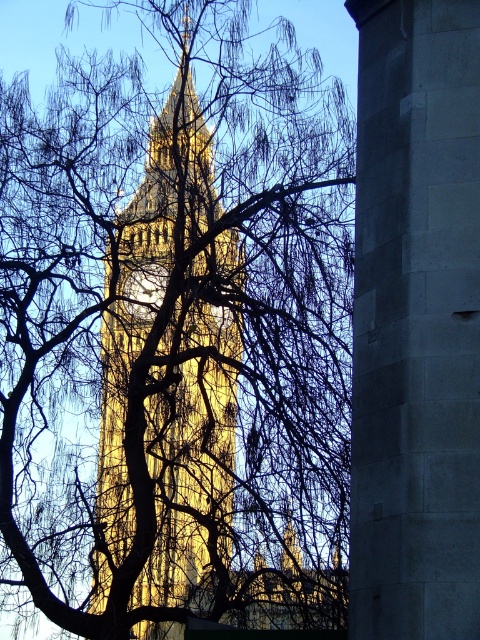
Question: In this image, where is gray stone pillar at center located relative to golden stone tower at center?

Choices:
 (A) left
 (B) right

Answer: (B)

Question: Which object is farther from the camera taking this photo?

Choices:
 (A) golden metallic clock at center
 (B) bare branches at center
 (C) golden stone tower at center
 (D) gray stone pillar at center

Answer: (A)

Question: Can you confirm if bare branches at center is bigger than golden stone tower at center?

Choices:
 (A) no
 (B) yes

Answer: (B)

Question: Can you confirm if bare branches at center is wider than gray stone pillar at center?

Choices:
 (A) yes
 (B) no

Answer: (A)

Question: Which point is closer to the camera?

Choices:
 (A) (294, 195)
 (B) (149, 524)
 (C) (132, 292)

Answer: (B)

Question: Based on their relative distances, which object is nearer to the bare branches at center?

Choices:
 (A) gray stone pillar at center
 (B) golden stone tower at center
 (C) golden metallic clock at center

Answer: (B)